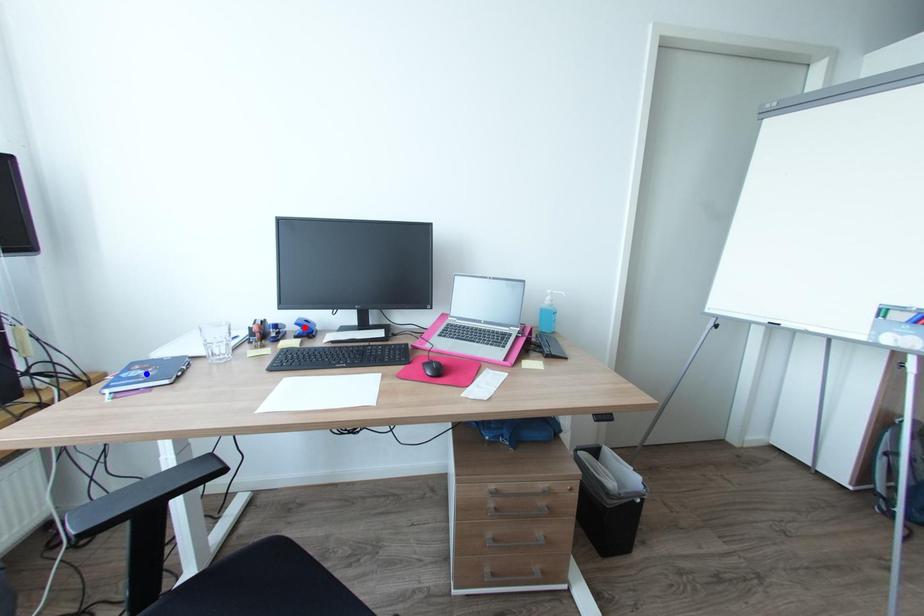
Question: Which of the two points in the image is closer to the camera?

Choices:
 (A) Blue point is closer.
 (B) Red point is closer.

Answer: (A)